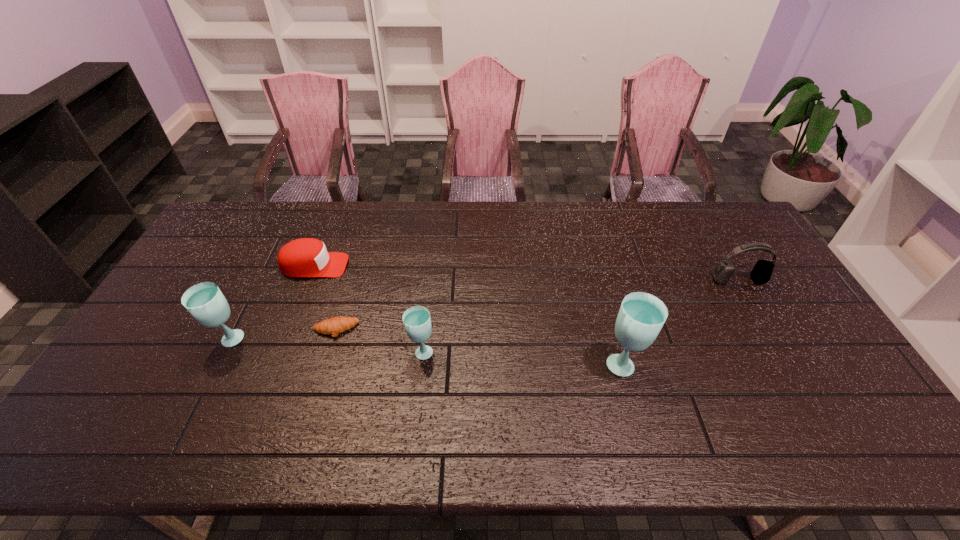
Identify the location of free region located 0.050m on the left of the shortest glass. (391, 351).

Where is `blank space located 0.150m on the right of the fifth object from left to right`? The image size is (960, 540). blank space located 0.150m on the right of the fifth object from left to right is located at coordinates (700, 363).

Identify the location of vacant space located on the back of the crescent roll. The width and height of the screenshot is (960, 540). (356, 257).

At what (x,y) coordinates should I click in order to perform the action: click on vacant space located on the headband of the rightmost object. Please return your answer as a coordinate pair (x, y). Looking at the image, I should click on (758, 315).

Find the location of a particular element. The image size is (960, 540). blank area located 0.330m on the front-facing side of the fifth tallest object is located at coordinates (449, 266).

I want to click on object located at the near edge, so click(641, 316).

In order to click on object positioned at the right edge in this screenshot , I will do `click(761, 273)`.

At what (x,y) coordinates should I click in order to perform the action: click on vacant area at the far edge. Please return your answer as a coordinate pair (x, y). Looking at the image, I should click on (666, 208).

Where is `vacant space at the near edge`? Image resolution: width=960 pixels, height=540 pixels. vacant space at the near edge is located at coordinates (716, 382).

This screenshot has height=540, width=960. In the image, there is a desktop. Find the location of `vacant space at the left edge`. vacant space at the left edge is located at coordinates (214, 270).